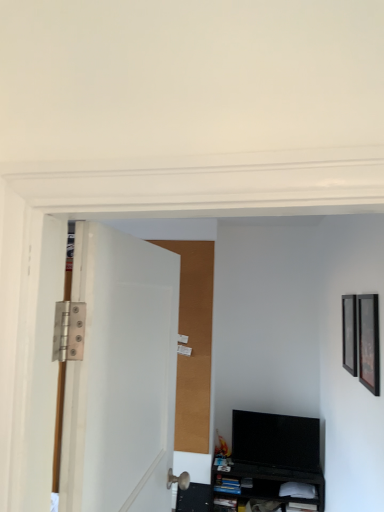
What are the coordinates of `vacant space in black glossy tv at lower right (from a real-world perspective)` in the screenshot? It's located at (272, 468).